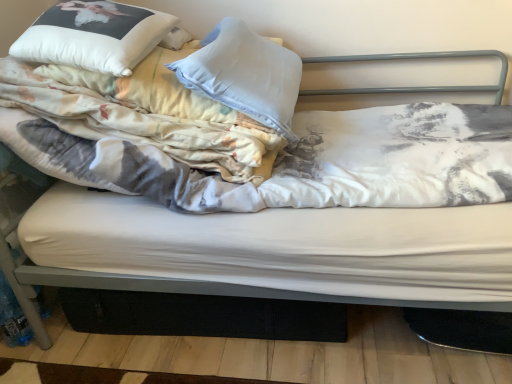
Question: Is printed cotton blanket at left bigger than white soft pillow at upper left, marked as the 1th pillow in a right-to-left arrangement?

Choices:
 (A) no
 (B) yes

Answer: (B)

Question: Would you say printed cotton blanket at left is a long distance from white soft pillow at upper left, marked as the 1th pillow in a right-to-left arrangement?

Choices:
 (A) yes
 (B) no

Answer: (B)

Question: Can you confirm if printed cotton blanket at left is positioned to the left of white soft pillow at upper left, acting as the 2th pillow starting from the left?

Choices:
 (A) yes
 (B) no

Answer: (A)

Question: Considering the relative sizes of printed cotton blanket at left and white soft pillow at upper left, marked as the 1th pillow in a right-to-left arrangement, in the image provided, is printed cotton blanket at left wider than white soft pillow at upper left, marked as the 1th pillow in a right-to-left arrangement,?

Choices:
 (A) yes
 (B) no

Answer: (A)

Question: Does printed cotton blanket at left turn towards white soft pillow at upper left, marked as the 1th pillow in a right-to-left arrangement?

Choices:
 (A) no
 (B) yes

Answer: (B)

Question: Considering the relative sizes of printed cotton blanket at left and white soft pillow at upper left, marked as the 1th pillow in a right-to-left arrangement, in the image provided, is printed cotton blanket at left thinner than white soft pillow at upper left, marked as the 1th pillow in a right-to-left arrangement,?

Choices:
 (A) no
 (B) yes

Answer: (A)

Question: Is the depth of printed cotton blanket at left greater than that of white soft pillow at upper left, which is the 1th pillow from left to right?

Choices:
 (A) yes
 (B) no

Answer: (B)

Question: Does printed cotton blanket at left come in front of white soft pillow at upper left, which is the 1th pillow from left to right?

Choices:
 (A) yes
 (B) no

Answer: (A)

Question: Would you say white soft pillow at upper left, which is the 2th pillow from right to left, is part of printed cotton blanket at left's contents?

Choices:
 (A) yes
 (B) no

Answer: (A)

Question: Are printed cotton blanket at left and white soft pillow at upper left, which is the 2th pillow from right to left, beside each other?

Choices:
 (A) no
 (B) yes

Answer: (A)

Question: Is printed cotton blanket at left positioned with its back to white soft pillow at upper left, which is the 2th pillow from right to left?

Choices:
 (A) no
 (B) yes

Answer: (B)

Question: Is printed cotton blanket at left thinner than white soft pillow at upper left, which is the 1th pillow from left to right?

Choices:
 (A) yes
 (B) no

Answer: (B)

Question: From the image's perspective, is white soft pillow at upper left, marked as the 1th pillow in a right-to-left arrangement, under printed cotton blanket at left?

Choices:
 (A) yes
 (B) no

Answer: (B)